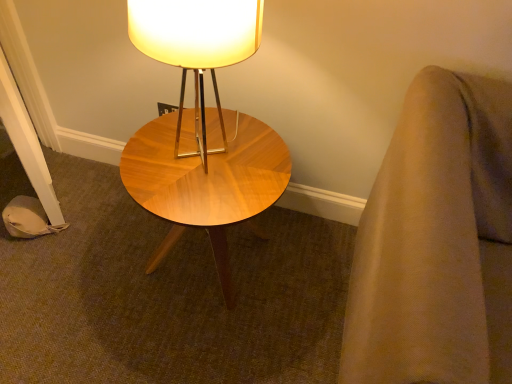
You are a GUI agent. You are given a task and a screenshot of the screen. Output one action in this format:
    pyautogui.click(x=<x>, y=<y>)
    Task: Click on the blank area beneath wooden lampshade at center (from a real-world perspective)
    
    Given the screenshot: What is the action you would take?
    pyautogui.click(x=206, y=148)